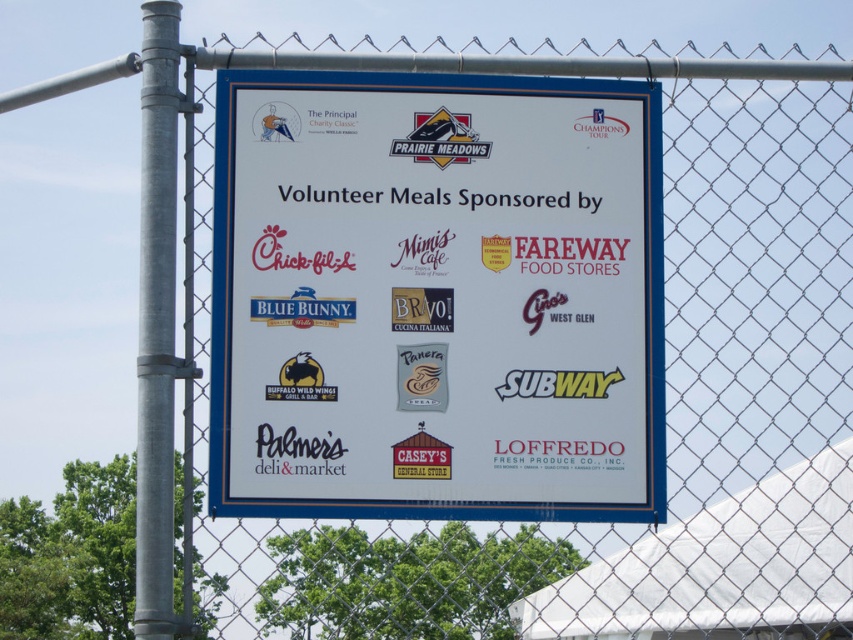
Question: Does white paper sign at center appear on the right side of matte red sign at center?

Choices:
 (A) yes
 (B) no

Answer: (A)

Question: Among these objects, which one is farthest from the camera?

Choices:
 (A) matte red sign at center
 (B) galvanized metal pole at left

Answer: (A)

Question: Which is nearer to the matte red sign at center?

Choices:
 (A) white paper sign at center
 (B) galvanized metal pole at left

Answer: (A)

Question: In this image, where is galvanized metal pole at left located relative to matte red sign at center?

Choices:
 (A) above
 (B) below

Answer: (B)

Question: Is galvanized metal pole at left positioned behind matte red sign at center?

Choices:
 (A) no
 (B) yes

Answer: (A)

Question: Which object appears closest to the camera in this image?

Choices:
 (A) galvanized metal pole at left
 (B) white paper sign at center
 (C) matte red sign at center

Answer: (A)